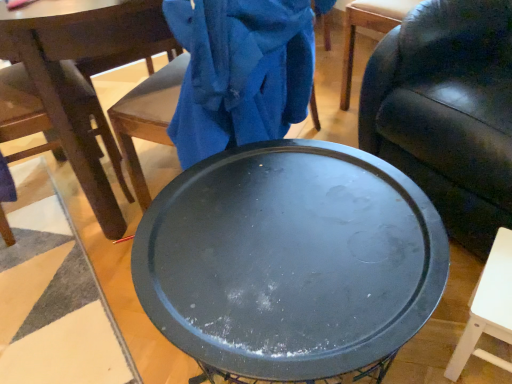
Question: Is dark brown wood chair at left, which is the second chair from right to left, taller or shorter than leather couch at center, the 2th chair when ordered from left to right?

Choices:
 (A) tall
 (B) short

Answer: (A)

Question: From a real-world perspective, relative to leather couch at center, the 2th chair when ordered from left to right, is dark brown wood chair at left, the 1th chair from the left, vertically above or below?

Choices:
 (A) below
 (B) above

Answer: (B)

Question: Estimate the real-world distances between objects in this image. Which object is closer to the matte black tray at center?

Choices:
 (A) leather couch at center, the 2th chair when ordered from left to right
 (B) dark brown wood chair at left, the 1th chair from the left
 (C) black matte round table at center

Answer: (A)

Question: Which of these objects is positioned farthest from the leather couch at center, the 1th chair when ordered from right to left?

Choices:
 (A) dark brown wood chair at left, the 1th chair from the left
 (B) matte black tray at center
 (C) black matte round table at center

Answer: (A)